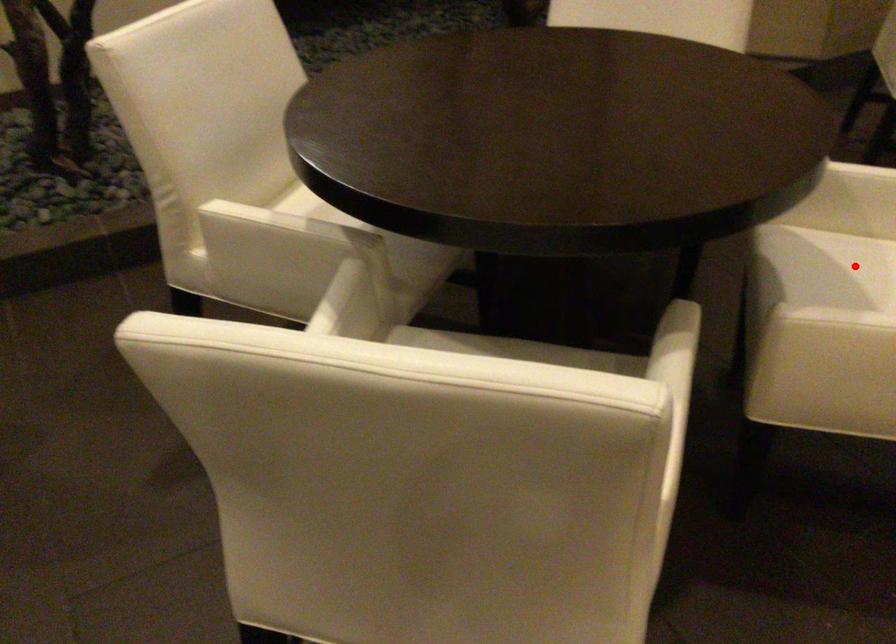
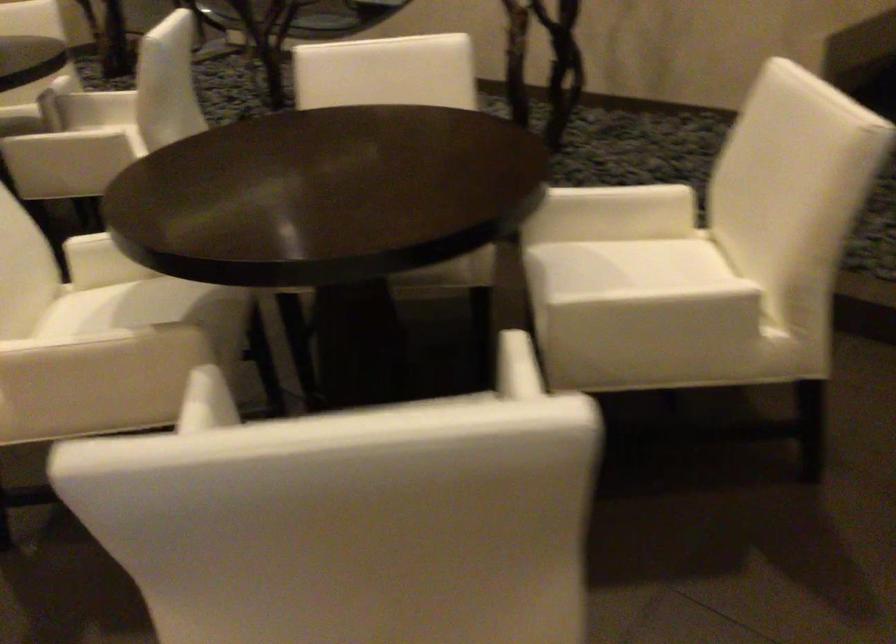
Question: I am providing you with two images of the same scene from different viewpoints. A red point is marked on the first image. Is the red point's position out of view in image 2?

Choices:
 (A) Yes
 (B) No

Answer: (A)